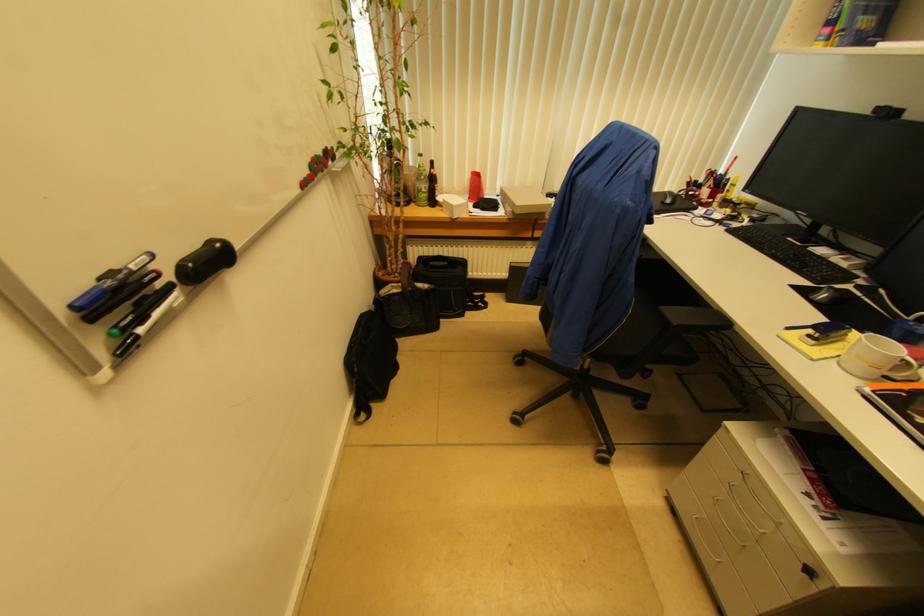
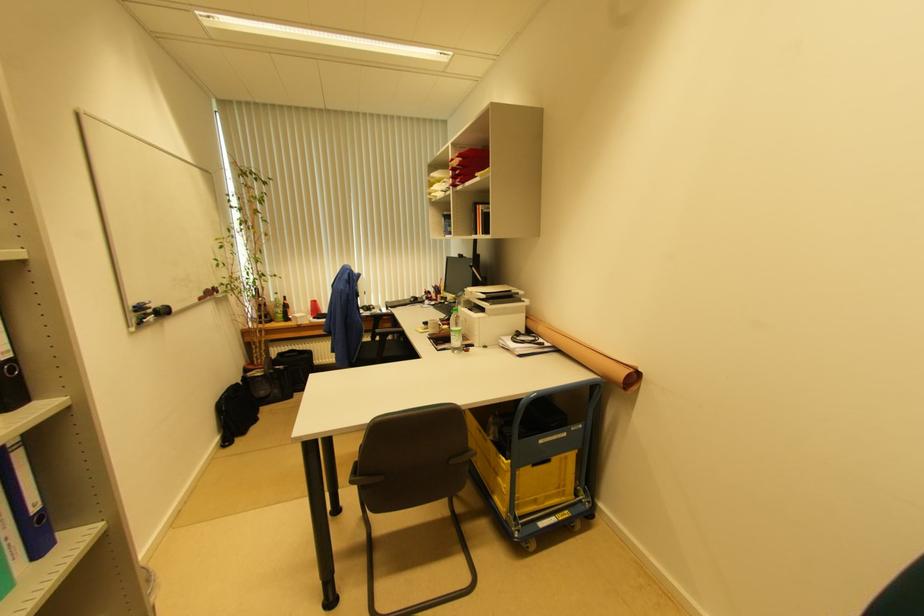
Find the pixel in the second image that matches (x=375, y=306) in the first image.

(242, 383)